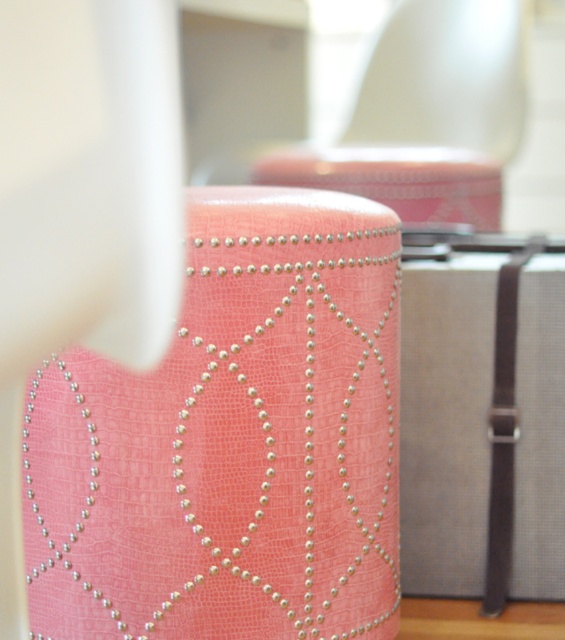
You are packing for a trip and have a pearltextured fabricstool at center and a gray fabric suitcase at center in front of you. You need to place both items into a storage bin that can only hold items within 9 inches apart. Can both items fit inside the bin without exceeding the distance limit?

The distance between the pearltextured fabricstool at center and the gray fabric suitcase at center is 9.08 inches, which exceeds the 9 inch limit. Therefore, they cannot both fit inside the bin without exceeding the distance limit.

You are examining the pink decorative stool with its textured surface and metallic rivets. You notice two points marked on the stool at coordinates point (523, 268) and point (486, 52). Which of these points is positioned closer to your viewpoint?

Point (523, 268) is closer to the viewer than point (486, 52).

You are an interior designer arranging furniture in a room. You have a pearltextured fabricstool at center and a pink textured ottoman at upper center. Based on their positions, which object is closer to the floor?

The pearltextured fabricstool at center is closer to the floor since it is located below the pink textured ottoman at upper center.